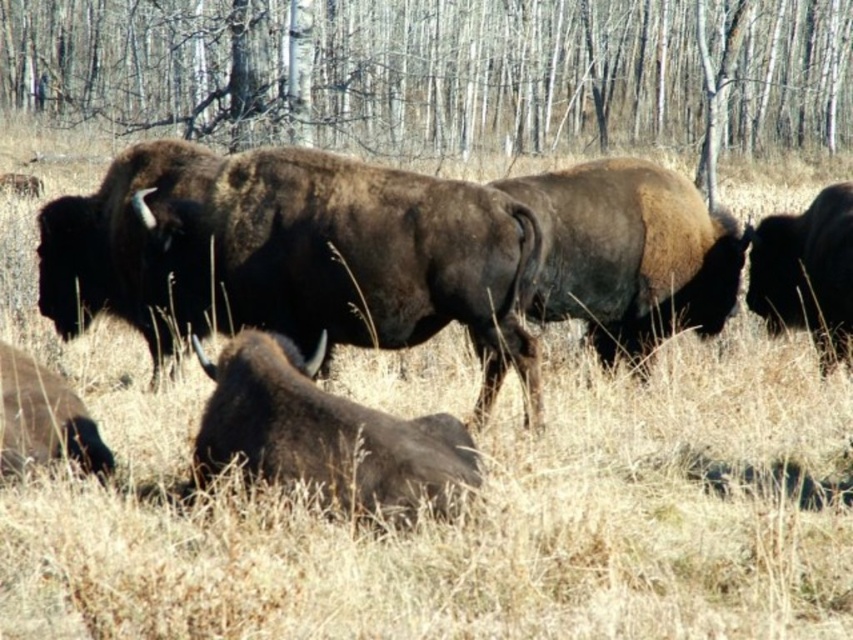
Question: Which object appears closest to the camera in this image?

Choices:
 (A) black fur at right
 (B) dark brown fur at center
 (C) brown furry bison at center
 (D) brown fuzzy bison at lower left

Answer: (B)

Question: Does brown furry bison at center appear over dark brown fur at center?

Choices:
 (A) yes
 (B) no

Answer: (A)

Question: Does brown rough fur at center appear over brown fuzzy bison at lower left?

Choices:
 (A) yes
 (B) no

Answer: (A)

Question: Which object is the farthest from the brown fuzzy bison at lower left?

Choices:
 (A) bare wood trees at upper center
 (B) brown rough fur at center
 (C) brown furry bison at center
 (D) dark brown fur at center

Answer: (A)

Question: Which point is farther from the camera taking this photo?

Choices:
 (A) (534, 157)
 (B) (558, 212)

Answer: (A)

Question: Is brown fuzzy bison at center smaller than dark brown fur at center?

Choices:
 (A) no
 (B) yes

Answer: (A)